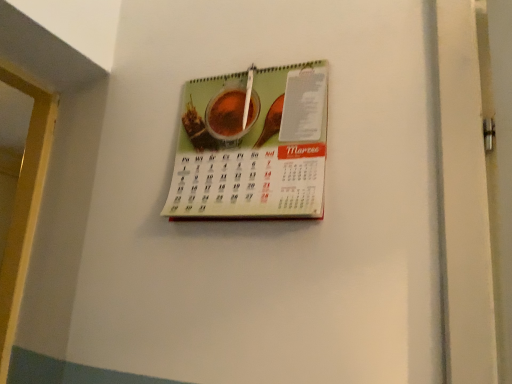
Describe the element at coordinates (252, 145) in the screenshot. Image resolution: width=512 pixels, height=384 pixels. I see `matte paper calendar at center` at that location.

What is the approximate width of matte paper calendar at center?

The width of matte paper calendar at center is 1.97 inches.

The width and height of the screenshot is (512, 384). In order to click on matte paper calendar at center in this screenshot , I will do `click(252, 145)`.

The width and height of the screenshot is (512, 384). What are the coordinates of `matte paper calendar at center` in the screenshot? It's located at (252, 145).